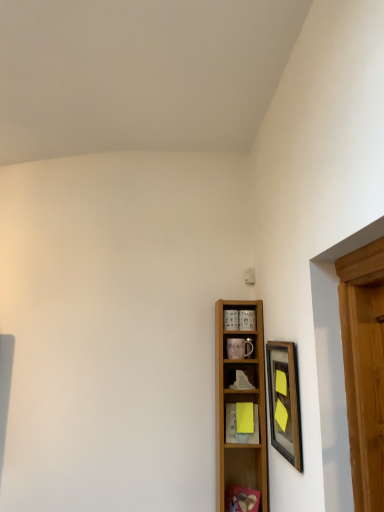
Question: Does wooden shelf at center, the third shelf ordered from the bottom, turn towards yellow paper at center, the 3th shelf viewed from the top?

Choices:
 (A) yes
 (B) no

Answer: (B)

Question: From a real-world perspective, is wooden shelf at center, the first shelf in the top-to-bottom sequence, beneath yellow paper at center, which is the 1th shelf from bottom to top?

Choices:
 (A) no
 (B) yes

Answer: (A)

Question: From the image's perspective, is wooden shelf at center, the first shelf in the top-to-bottom sequence, located above yellow paper at center, the 3th shelf viewed from the top?

Choices:
 (A) no
 (B) yes

Answer: (B)

Question: Is wooden shelf at center, the third shelf ordered from the bottom, oriented away from yellow paper at center, which is the 1th shelf from bottom to top?

Choices:
 (A) yes
 (B) no

Answer: (B)

Question: Is wooden shelf at center, the third shelf ordered from the bottom, far from yellow paper at center, the 3th shelf viewed from the top?

Choices:
 (A) yes
 (B) no

Answer: (B)

Question: Is wooden shelf at center, the first shelf in the top-to-bottom sequence, outside of yellow paper at center, which is the 1th shelf from bottom to top?

Choices:
 (A) yes
 (B) no

Answer: (A)

Question: Does wooden framed picture at right have a larger size compared to wooden shelf at center, the second shelf viewed from the top?

Choices:
 (A) no
 (B) yes

Answer: (A)

Question: Does wooden framed picture at right have a greater width compared to wooden shelf at center, placed as the second shelf when sorted from bottom to top?

Choices:
 (A) yes
 (B) no

Answer: (B)

Question: Considering the relative positions of wooden framed picture at right and wooden shelf at center, the second shelf viewed from the top, in the image provided, is wooden framed picture at right to the right of wooden shelf at center, the second shelf viewed from the top, from the viewer's perspective?

Choices:
 (A) yes
 (B) no

Answer: (A)

Question: Can you confirm if wooden framed picture at right is taller than wooden shelf at center, the second shelf viewed from the top?

Choices:
 (A) yes
 (B) no

Answer: (B)

Question: From a real-world perspective, is wooden framed picture at right physically above wooden shelf at center, placed as the second shelf when sorted from bottom to top?

Choices:
 (A) yes
 (B) no

Answer: (A)

Question: Is wooden framed picture at right looking in the opposite direction of wooden shelf at center, the second shelf viewed from the top?

Choices:
 (A) yes
 (B) no

Answer: (B)

Question: Does yellow paper at center, the 3th shelf viewed from the top, have a lesser width compared to wooden shelf at center, the third shelf ordered from the bottom?

Choices:
 (A) yes
 (B) no

Answer: (A)